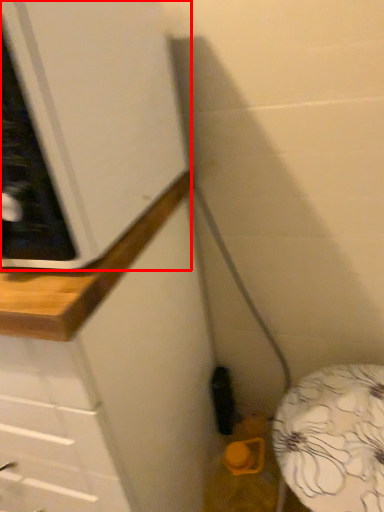
Question: From the image's perspective, considering the relative positions of cabinetry (annotated by the red box) and counter in the image provided, where is cabinetry (annotated by the red box) located with respect to the staircase?

Choices:
 (A) above
 (B) below

Answer: (A)